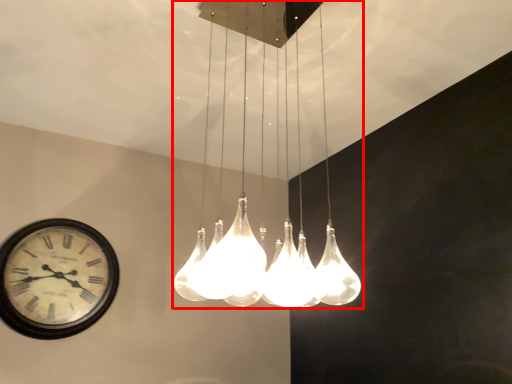
Question: From the image's perspective, where is lamp (annotated by the red box) located relative to wall clock?

Choices:
 (A) above
 (B) below

Answer: (A)